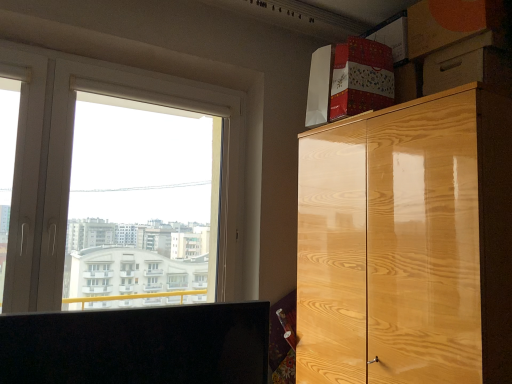
This screenshot has height=384, width=512. Find the location of `empty space that is ontop of white plastic window at upper left (from a real-world perspective)`. empty space that is ontop of white plastic window at upper left (from a real-world perspective) is located at coordinates (154, 69).